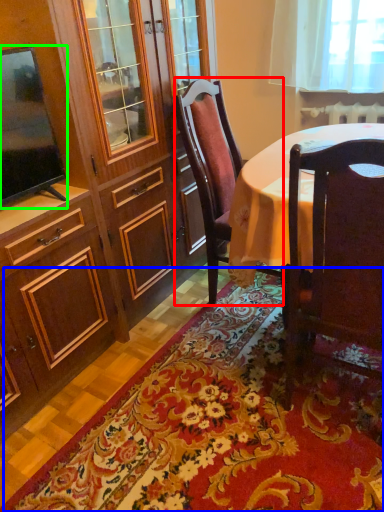
Question: Which object is positioned closest to chair (highlighted by a red box)? Select from mat (highlighted by a blue box) and television (highlighted by a green box).

Choices:
 (A) mat
 (B) television

Answer: (B)